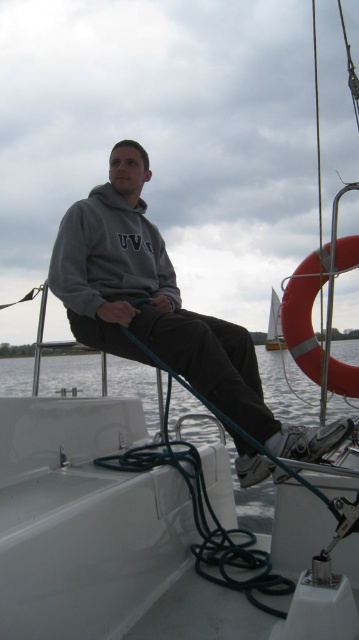
Question: Can you confirm if gray fleece sweatshirt at center is positioned to the left of white fabric sail at center?

Choices:
 (A) yes
 (B) no

Answer: (A)

Question: Which object is positioned closest to the gray fleece sweatshirt at center?

Choices:
 (A) white glossy water at lower center
 (B) gray fleece hoodie at center

Answer: (B)

Question: Considering the real-world distances, which object is closest to the white glossy water at lower center?

Choices:
 (A) gray fleece sweatshirt at center
 (B) gray fleece hoodie at center
 (C) white fabric sail at center

Answer: (A)

Question: Is white glossy water at lower center bigger than gray fleece sweatshirt at center?

Choices:
 (A) yes
 (B) no

Answer: (A)

Question: Does gray fleece hoodie at center have a lesser width compared to white glossy water at lower center?

Choices:
 (A) no
 (B) yes

Answer: (B)

Question: Considering the real-world distances, which object is farthest from the white glossy water at lower center?

Choices:
 (A) white fabric sail at center
 (B) gray fleece sweatshirt at center

Answer: (A)